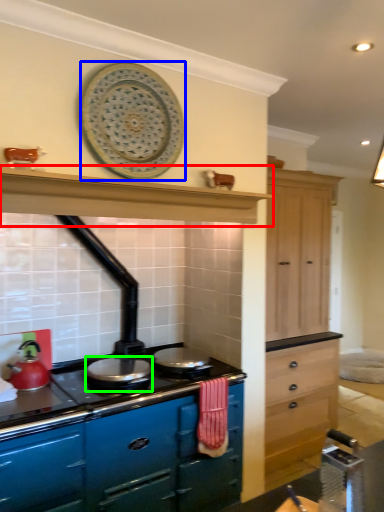
Question: Which object is the farthest from exhaust hood (highlighted by a red box)? Choose among these: platter (highlighted by a blue box) or appliance (highlighted by a green box).

Choices:
 (A) platter
 (B) appliance

Answer: (B)